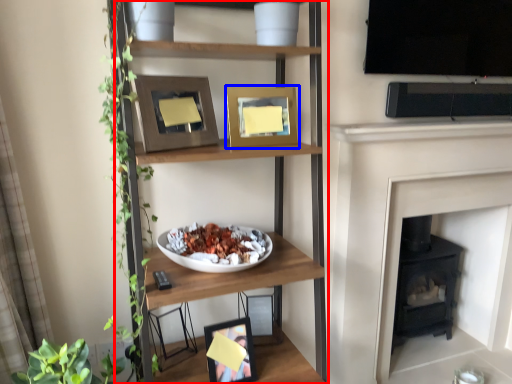
Question: Which of the following is the closest to the observer, shelf (highlighted by a red box) or picture frame (highlighted by a blue box)?

Choices:
 (A) shelf
 (B) picture frame

Answer: (A)